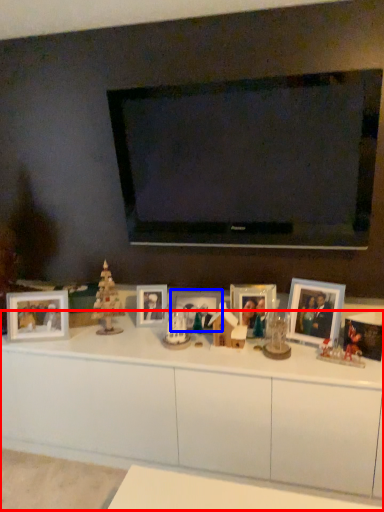
Question: Which of the following is the farthest to the observer, table (highlighted by a red box) or picture frame (highlighted by a blue box)?

Choices:
 (A) table
 (B) picture frame

Answer: (B)